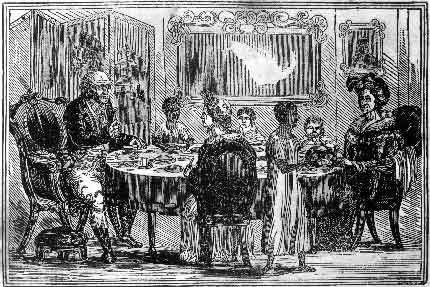
You are a GUI agent. You are given a task and a screenshot of the screen. Output one action in this format:
    pyautogui.click(x=<x>, y=<y>)
    Task: Click on the dressing folding wall
    
    Given the screenshot: What is the action you would take?
    pyautogui.click(x=126, y=63)